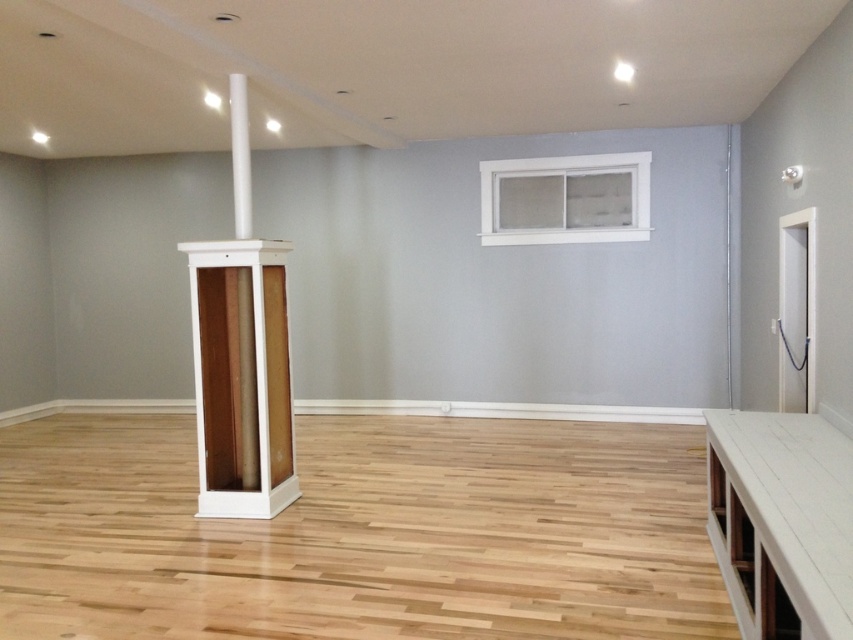
Question: Among these objects, which one is farthest from the camera?

Choices:
 (A) white painted wood window at upper right
 (B) white wood pillar at center
 (C) white wood cabinet at center
 (D) white painted wood table at lower right

Answer: (A)

Question: Does white painted wood table at lower right have a greater width compared to white wood pillar at center?

Choices:
 (A) no
 (B) yes

Answer: (B)

Question: Which point is closer to the camera?

Choices:
 (A) (845, 564)
 (B) (479, 163)
 (C) (245, 173)

Answer: (A)

Question: Is white painted wood table at lower right wider than white wood pillar at center?

Choices:
 (A) yes
 (B) no

Answer: (A)

Question: Among these objects, which one is farthest from the camera?

Choices:
 (A) white painted wood table at lower right
 (B) white wood pillar at center

Answer: (B)

Question: Can you confirm if white painted wood window at upper right is thinner than white wood pillar at center?

Choices:
 (A) yes
 (B) no

Answer: (B)